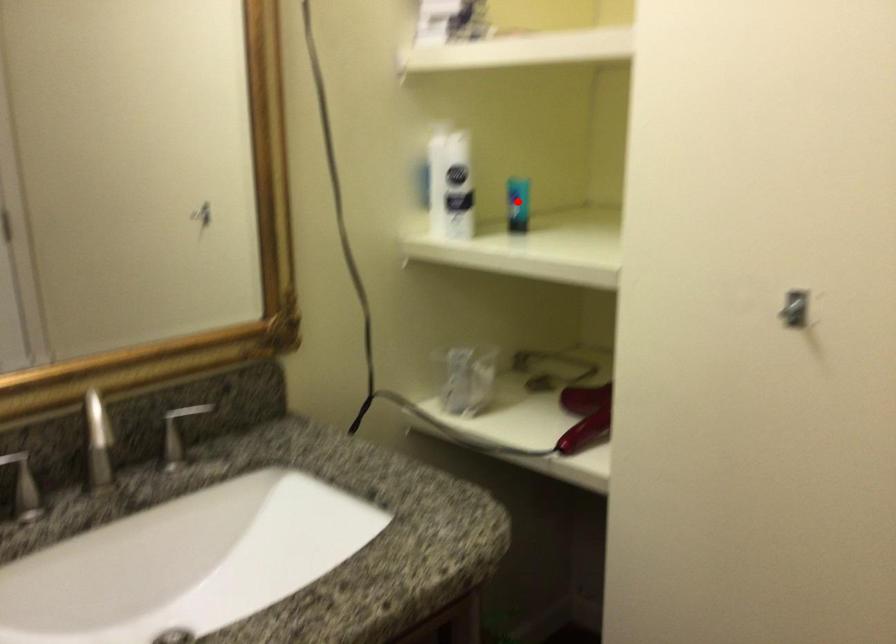
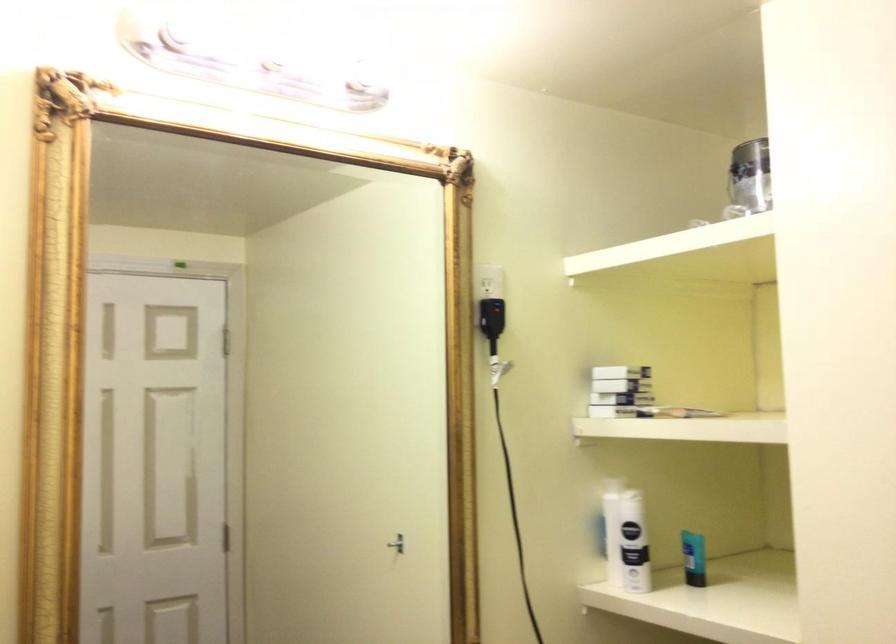
Question: I am providing you with two images of the same scene from different viewpoints. A red point is marked on the first image. At the location where the point appears in image 1, is it still visible in image 2?

Choices:
 (A) Yes
 (B) No

Answer: (A)